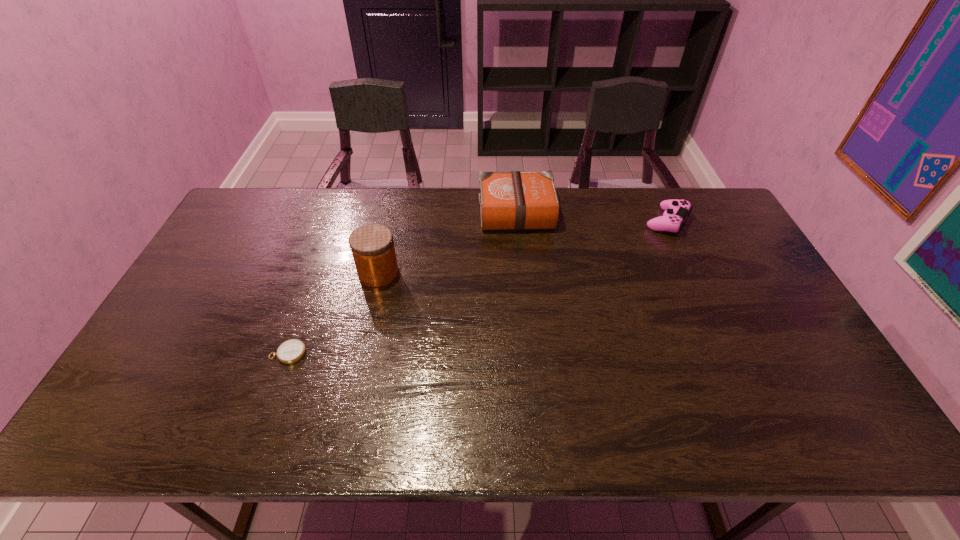
At what (x,y) coordinates should I click in order to perform the action: click on jar. Please return your answer as a coordinate pair (x, y). Looking at the image, I should click on (372, 246).

This screenshot has height=540, width=960. In order to click on the third farthest object in this screenshot , I will do `click(372, 246)`.

You are a GUI agent. You are given a task and a screenshot of the screen. Output one action in this format:
    pyautogui.click(x=<x>, y=<y>)
    Task: Click on the Bible
    The height and width of the screenshot is (540, 960).
    Given the screenshot: What is the action you would take?
    pyautogui.click(x=515, y=200)

The image size is (960, 540). In order to click on the second tallest object in this screenshot , I will do `click(515, 200)`.

The image size is (960, 540). I want to click on the rightmost object, so click(x=675, y=211).

Locate an element on the screen. The image size is (960, 540). the second shortest object is located at coordinates (675, 211).

At what (x,y) coordinates should I click in order to perform the action: click on the shortest object. Please return your answer as a coordinate pair (x, y). This screenshot has height=540, width=960. Looking at the image, I should click on (291, 351).

Find the location of `compass`. compass is located at coordinates (291, 351).

You are a GUI agent. You are given a task and a screenshot of the screen. Output one action in this format:
    pyautogui.click(x=<x>, y=<y>)
    Task: Click on the vacant position located on the front of the tallest object
    This screenshot has height=540, width=960.
    Given the screenshot: What is the action you would take?
    (348, 409)

You are a GUI agent. You are given a task and a screenshot of the screen. Output one action in this format:
    pyautogui.click(x=<x>, y=<y>)
    Task: Click on the vacant space positioned on the right of the third object from left to right
    The image size is (960, 540).
    Given the screenshot: What is the action you would take?
    pyautogui.click(x=588, y=211)